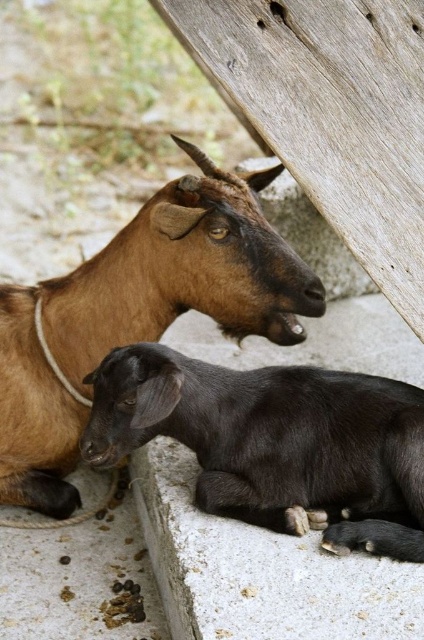
Question: Does brown matte goat at center lie behind black matte goat at lower center?

Choices:
 (A) yes
 (B) no

Answer: (A)

Question: Which of the following is the closest to the observer?

Choices:
 (A) brown matte goat at center
 (B) black matte goat at lower center

Answer: (B)

Question: Is brown matte goat at center bigger than black matte goat at lower center?

Choices:
 (A) yes
 (B) no

Answer: (A)

Question: Which of the following is the closest to the observer?

Choices:
 (A) (223, 227)
 (B) (256, 458)

Answer: (A)

Question: Is brown matte goat at center smaller than black matte goat at lower center?

Choices:
 (A) yes
 (B) no

Answer: (B)